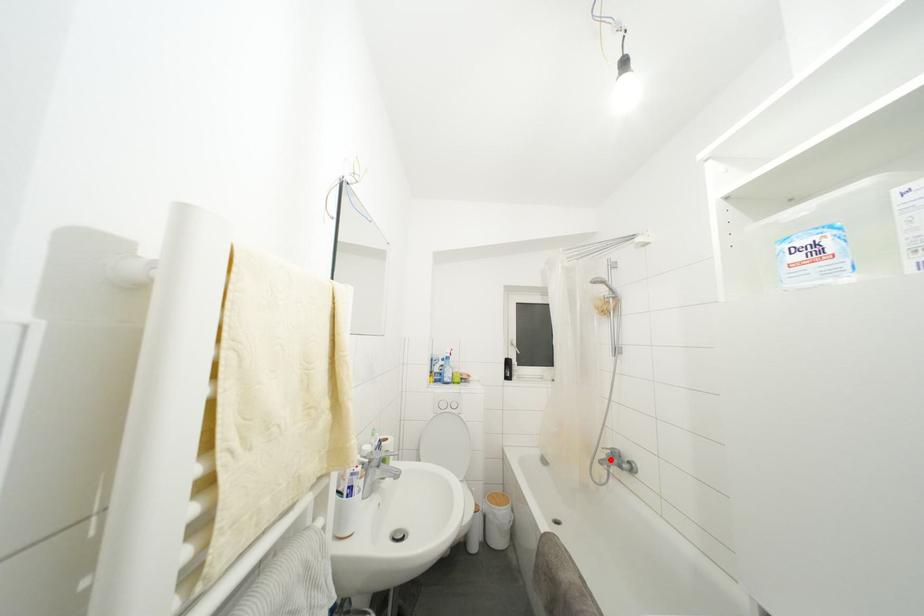
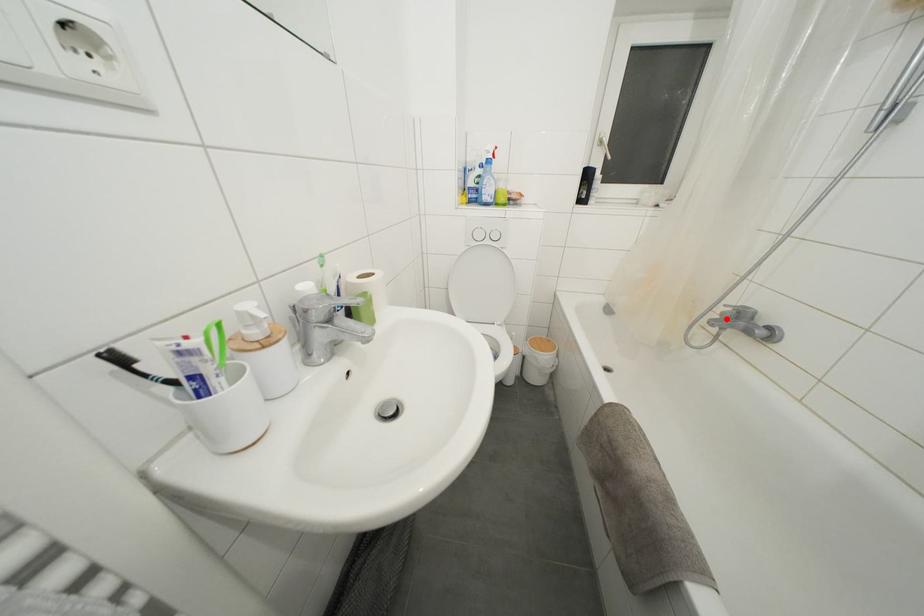
I am providing you with two images of the same scene from different viewpoints. A red point is marked on the first image and another point is marked on the second image. Does the point marked in image1 correspond to the same location as the one in image2?

Yes